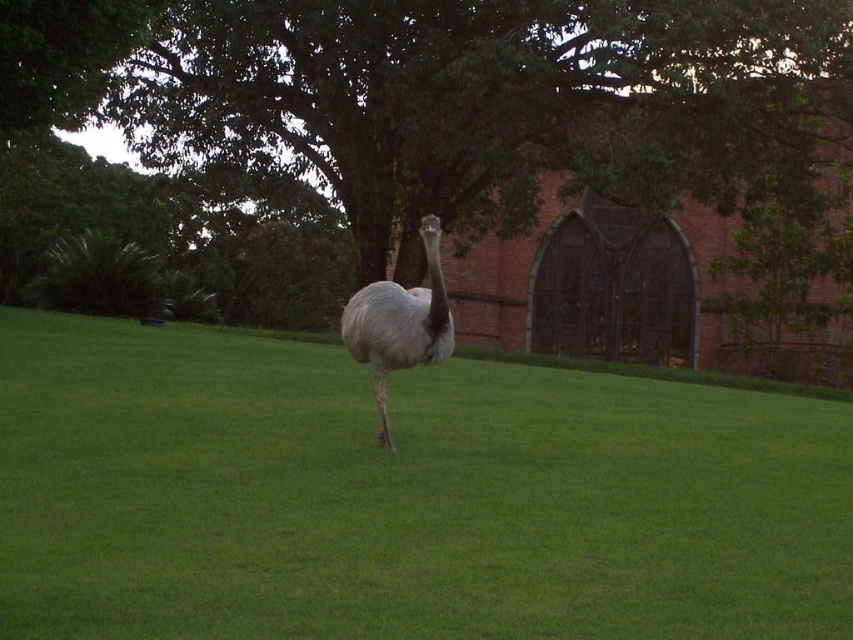
Question: Is green grass at center positioned behind green leafy tree at center?

Choices:
 (A) yes
 (B) no

Answer: (B)

Question: Which point is farther from the camera taking this photo?

Choices:
 (A) (386, 424)
 (B) (283, 6)

Answer: (B)

Question: Which point appears farthest from the camera in this image?

Choices:
 (A) (234, 65)
 (B) (392, 365)
 (C) (648, 404)

Answer: (A)

Question: Which object is positioned closest to the gray feathered ostrich at center?

Choices:
 (A) green grass at center
 (B) green leafy tree at center

Answer: (A)

Question: From the image, what is the correct spatial relationship of green grass at center in relation to green leafy tree at center?

Choices:
 (A) below
 (B) above

Answer: (A)

Question: Can you confirm if green grass at center is smaller than green leafy tree at center?

Choices:
 (A) no
 (B) yes

Answer: (B)